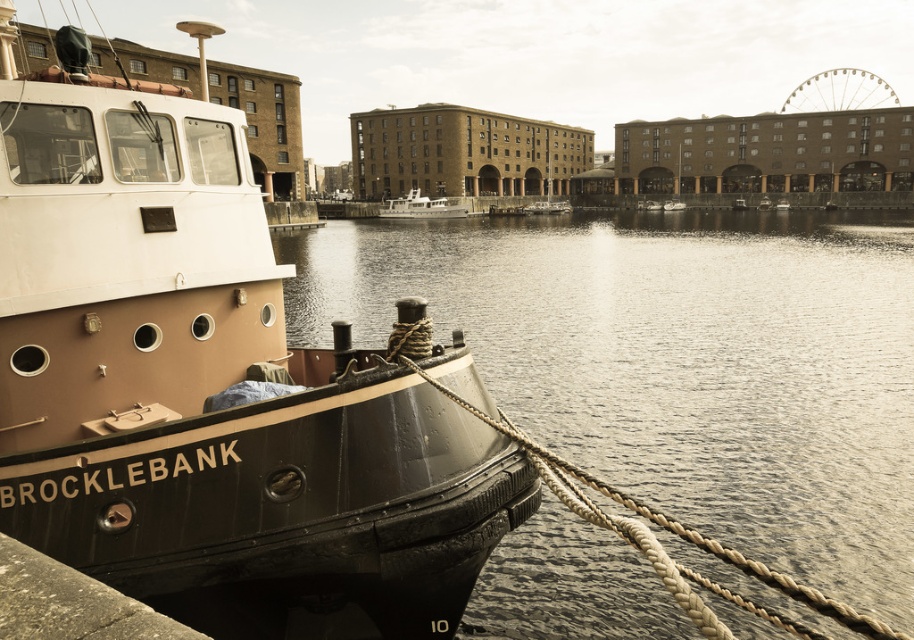
You are standing on the pier and notice the matte black boat at left and the rope at left. Which object is positioned higher relative to the other?

The matte black boat at left is located above the rope at left, so it is positioned higher.

You are a dock worker observing the waterfront scene. You need to secure a new rope between the matte black boat at left and the white glossy boat at center. Based on their positions, which boat should you attach the rope to first to ensure proper alignment?

The matte black boat at left is positioned under the white glossy boat at center, so you should attach the rope to the white glossy boat at center first to ensure proper alignment.

You are standing on the pier looking at the tugboat Brocklebank. There are two points marked on the boat, one at coordinate point (455, 216) and another at point (535, 205). Which point is closer to you?

Point (455, 216) is closer to the viewer than point (535, 205).